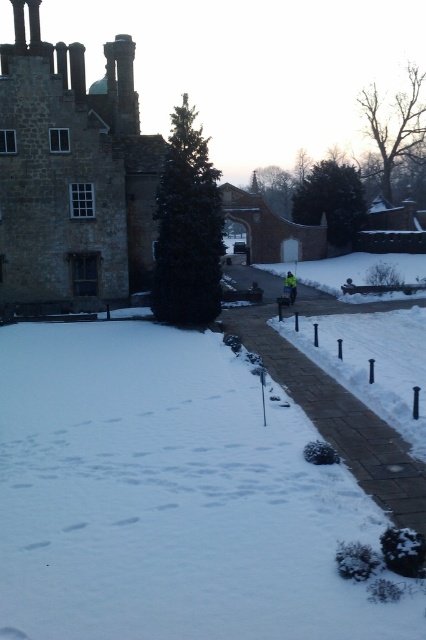
Question: Does brick paved path at center appear on the left side of yellow reflective jacket at center?

Choices:
 (A) no
 (B) yes

Answer: (A)

Question: Among these objects, which one is farthest from the camera?

Choices:
 (A) brick paved path at center
 (B) yellow reflective jacket at center

Answer: (B)

Question: Which of the following is the closest to the observer?

Choices:
 (A) (374, 307)
 (B) (290, 275)

Answer: (A)

Question: Which point is closer to the camera?

Choices:
 (A) yellow reflective jacket at center
 (B) brick paved path at center

Answer: (B)

Question: Is brick paved path at center positioned before yellow reflective jacket at center?

Choices:
 (A) no
 (B) yes

Answer: (B)

Question: Is brick paved path at center to the left of yellow reflective jacket at center from the viewer's perspective?

Choices:
 (A) no
 (B) yes

Answer: (A)